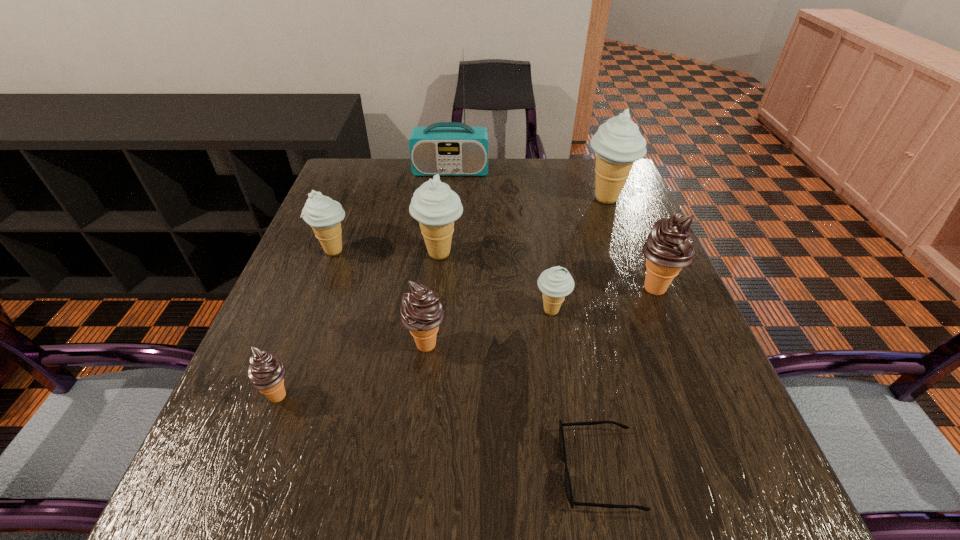
Locate an element on the screen. The width and height of the screenshot is (960, 540). icecream object that ranks as the third closest to the smallest chocolate icecream is located at coordinates (434, 205).

Choose which beige icecream is the second nearest neighbor to the second beige icecream from right to left. Please provide its 2D coordinates. Your answer should be formatted as a tuple, i.e. [(x, y)], where the tuple contains the x and y coordinates of a point satisfying the conditions above.

[(618, 143)]

Identify which beige icecream is the third closest to the shortest object. Please provide its 2D coordinates. Your answer should be formatted as a tuple, i.e. [(x, y)], where the tuple contains the x and y coordinates of a point satisfying the conditions above.

[(324, 215)]

Select which chocolate icecream appears as the second closest to the biggest chocolate icecream. Please provide its 2D coordinates. Your answer should be formatted as a tuple, i.e. [(x, y)], where the tuple contains the x and y coordinates of a point satisfying the conditions above.

[(266, 373)]

Locate an element on the screen. This screenshot has height=540, width=960. chocolate icecream that is the second nearest to the shortest object is located at coordinates (668, 248).

Locate an element on the screen. This screenshot has height=540, width=960. free location that satisfies the following two spatial constraints: 1. on the front panel of the radio receiver; 2. on the left side of the rightmost chocolate icecream is located at coordinates (440, 289).